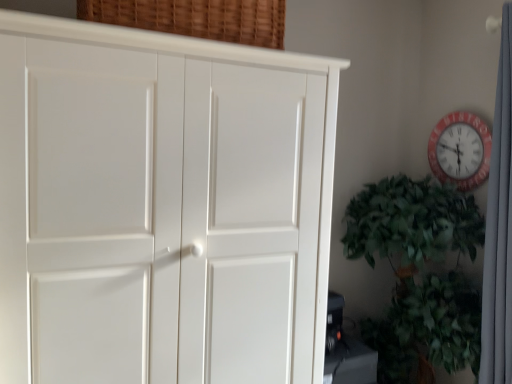
Describe the element at coordinates (161, 206) in the screenshot. I see `white matte cupboard at left` at that location.

What do you see at coordinates (499, 227) in the screenshot? I see `white fabric curtain at right` at bounding box center [499, 227].

Locate an element on the screen. Image resolution: width=512 pixels, height=384 pixels. white fabric curtain at right is located at coordinates (499, 227).

At what (x,y) coordinates should I click in order to perform the action: click on green leafy plant at right. Please return your answer as a coordinate pair (x, y). Looking at the image, I should click on (419, 274).

Where is `white matte cupboard at left`? white matte cupboard at left is located at coordinates (161, 206).

Is white matte cupboard at left bigger than green leafy plant at right?

Yes.

From the image's perspective, which one is positioned higher, white matte cupboard at left or green leafy plant at right?

white matte cupboard at left, from the image's perspective.

Between white matte cupboard at left and green leafy plant at right, which one appears on the left side from the viewer's perspective?

Positioned to the left is white matte cupboard at left.

Considering the sizes of objects white matte cupboard at left and green leafy plant at right in the image provided, who is thinner, white matte cupboard at left or green leafy plant at right?

white matte cupboard at left is thinner.

Considering the positions of objects red plastic wall clock at upper right and woven wood basket at upper center in the image provided, who is in front, red plastic wall clock at upper right or woven wood basket at upper center?

woven wood basket at upper center is more forward.

Consider the image. Is red plastic wall clock at upper right with woven wood basket at upper center?

red plastic wall clock at upper right and woven wood basket at upper center are not in contact.

Would you say red plastic wall clock at upper right is to the left or to the right of woven wood basket at upper center in the picture?

red plastic wall clock at upper right is to the right of woven wood basket at upper center.

Could you tell me if red plastic wall clock at upper right is facing woven wood basket at upper center?

Yes, red plastic wall clock at upper right is turned towards woven wood basket at upper center.

Are white matte cupboard at left and woven wood basket at upper center located far from each other?

No.

Considering the positions of objects white matte cupboard at left and woven wood basket at upper center in the image provided, who is more to the right, white matte cupboard at left or woven wood basket at upper center?

woven wood basket at upper center is more to the right.

Considering the sizes of objects white matte cupboard at left and woven wood basket at upper center in the image provided, who is smaller, white matte cupboard at left or woven wood basket at upper center?

With smaller size is woven wood basket at upper center.

Looking at this image, from the image's perspective, is white matte cupboard at left below woven wood basket at upper center?

Yes, from the image's perspective, white matte cupboard at left is below woven wood basket at upper center.

Is green leafy plant at right situated inside red plastic wall clock at upper right or outside?

green leafy plant at right is not inside red plastic wall clock at upper right, it's outside.

Measure the distance between green leafy plant at right and red plastic wall clock at upper right.

green leafy plant at right and red plastic wall clock at upper right are 14.64 inches apart from each other.

Is green leafy plant at right further to camera compared to red plastic wall clock at upper right?

No.

Is green leafy plant at right placed right next to red plastic wall clock at upper right?

They are not placed beside each other.

Are woven wood basket at upper center and white fabric curtain at right making contact?

woven wood basket at upper center is not next to white fabric curtain at right, and they're not touching.

Is point (198, 22) positioned in front of point (510, 259)?

Yes, point (198, 22) is closer to viewer.

From a real-world perspective, does woven wood basket at upper center sit lower than white fabric curtain at right?

No, from a real-world perspective, woven wood basket at upper center is not below white fabric curtain at right.

Who is more distant, white matte cupboard at left or red plastic wall clock at upper right?

red plastic wall clock at upper right is further from the camera.

Looking at this image, from a real-world perspective, is white matte cupboard at left physically located above or below red plastic wall clock at upper right?

From a real-world perspective, white matte cupboard at left is physically below red plastic wall clock at upper right.

This screenshot has width=512, height=384. Identify the location of wall clock that appears on the right of white matte cupboard at left. (460, 150).

Which of these two, green leafy plant at right or white fabric curtain at right, is thinner?

Thinner between the two is white fabric curtain at right.

Is green leafy plant at right aimed at white fabric curtain at right?

Yes, green leafy plant at right is turned towards white fabric curtain at right.

From the image's perspective, would you say green leafy plant at right is shown under white fabric curtain at right?

Correct, green leafy plant at right appears lower than white fabric curtain at right in the image.

Is point (460, 205) closer or farther from the camera than point (506, 371)?

Point (460, 205) is farther from the camera than point (506, 371).

Identify the location of houseplant below the white matte cupboard at left (from the image's perspective). (419, 274).

The width and height of the screenshot is (512, 384). What are the coordinates of `basket located above the red plastic wall clock at upper right (from a real-world perspective)` in the screenshot? It's located at (196, 18).

When comparing their distances from white fabric curtain at right, does white matte cupboard at left or red plastic wall clock at upper right seem closer?

Among the two, red plastic wall clock at upper right is located nearer to white fabric curtain at right.

When comparing their distances from woven wood basket at upper center, does green leafy plant at right or white fabric curtain at right seem closer?

Based on the image, green leafy plant at right appears to be nearer to woven wood basket at upper center.

When comparing their distances from woven wood basket at upper center, does white fabric curtain at right or red plastic wall clock at upper right seem closer?

The object closer to woven wood basket at upper center is white fabric curtain at right.

Consider the image. From the image, which object appears to be nearer to red plastic wall clock at upper right, green leafy plant at right or white fabric curtain at right?

white fabric curtain at right.

Which object lies nearer to the anchor point white matte cupboard at left, red plastic wall clock at upper right or white fabric curtain at right?

The object closer to white matte cupboard at left is white fabric curtain at right.

Which object lies further to the anchor point red plastic wall clock at upper right, green leafy plant at right or woven wood basket at upper center?

Among the two, woven wood basket at upper center is located further to red plastic wall clock at upper right.

When comparing their distances from white matte cupboard at left, does woven wood basket at upper center or white fabric curtain at right seem further?

white fabric curtain at right lies further to white matte cupboard at left than the other object.

Looking at the image, which one is located closer to white fabric curtain at right, red plastic wall clock at upper right or green leafy plant at right?

Based on the image, green leafy plant at right appears to be nearer to white fabric curtain at right.

Identify the location of houseplant situated between woven wood basket at upper center and white fabric curtain at right from left to right. This screenshot has width=512, height=384. (419, 274).

Where is `wall clock between woven wood basket at upper center and white fabric curtain at right`? wall clock between woven wood basket at upper center and white fabric curtain at right is located at coordinates (x=460, y=150).

In order to click on curtain between red plastic wall clock at upper right and green leafy plant at right vertically in this screenshot , I will do `click(499, 227)`.

You are a GUI agent. You are given a task and a screenshot of the screen. Output one action in this format:
    pyautogui.click(x=<x>, y=<y>)
    Task: Click on the houseplant between white matte cupboard at left and white fabric curtain at right
    The width and height of the screenshot is (512, 384).
    Given the screenshot: What is the action you would take?
    pyautogui.click(x=419, y=274)